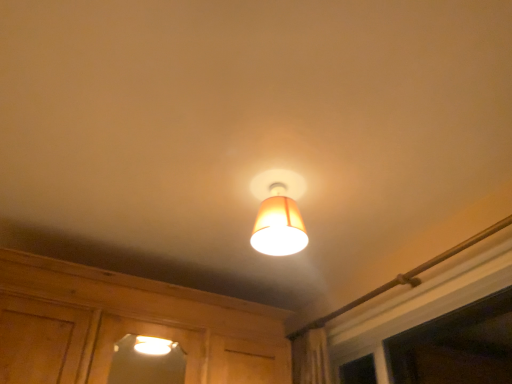
Locate an element on the screen. The width and height of the screenshot is (512, 384). matte orange fabric lampshade at center is located at coordinates (278, 213).

Describe the element at coordinates (278, 213) in the screenshot. This screenshot has height=384, width=512. I see `matte orange fabric lampshade at center` at that location.

The height and width of the screenshot is (384, 512). What do you see at coordinates (457, 346) in the screenshot?
I see `white plastic window at upper right` at bounding box center [457, 346].

Measure the distance between white plastic window at upper right and camera.

The depth of white plastic window at upper right is 7.10 feet.

The width and height of the screenshot is (512, 384). I want to click on white plastic window at upper right, so click(457, 346).

Locate an element on the screen. The width and height of the screenshot is (512, 384). matte orange fabric lampshade at center is located at coordinates (278, 213).

Which object is positioned more to the right, matte orange fabric lampshade at center or white plastic window at upper right?

From the viewer's perspective, white plastic window at upper right appears more on the right side.

Which is behind, matte orange fabric lampshade at center or white plastic window at upper right?

matte orange fabric lampshade at center is behind.

Is point (275, 196) closer or farther from the camera than point (449, 368)?

Clearly, point (275, 196) is closer to the camera than point (449, 368).

From the image's perspective, is matte orange fabric lampshade at center above white plastic window at upper right?

Yes, from the image's perspective, matte orange fabric lampshade at center is over white plastic window at upper right.

From a real-world perspective, is matte orange fabric lampshade at center located beneath white plastic window at upper right?

No, from a real-world perspective, matte orange fabric lampshade at center is not under white plastic window at upper right.

Based on the photo, can you confirm if matte orange fabric lampshade at center is thinner than white plastic window at upper right?

Incorrect, the width of matte orange fabric lampshade at center is not less than that of white plastic window at upper right.

Who is shorter, matte orange fabric lampshade at center or white plastic window at upper right?

With less height is matte orange fabric lampshade at center.

Who is smaller, matte orange fabric lampshade at center or white plastic window at upper right?

matte orange fabric lampshade at center.

Is matte orange fabric lampshade at center located outside white plastic window at upper right?

Yes, matte orange fabric lampshade at center is not within white plastic window at upper right.

Are matte orange fabric lampshade at center and white plastic window at upper right making contact?

No, matte orange fabric lampshade at center is not next to white plastic window at upper right.

Is matte orange fabric lampshade at center looking in the opposite direction of white plastic window at upper right?

No.

What's the angular difference between matte orange fabric lampshade at center and white plastic window at upper right's facing directions?

The angular difference between matte orange fabric lampshade at center and white plastic window at upper right is 90 degrees.

Measure the distance between matte orange fabric lampshade at center and white plastic window at upper right.

matte orange fabric lampshade at center and white plastic window at upper right are 1.38 meters apart from each other.

In order to click on window that appears on the right of matte orange fabric lampshade at center in this screenshot , I will do `click(457, 346)`.

Which object is positioned more to the right, white plastic window at upper right or matte orange fabric lampshade at center?

white plastic window at upper right.

Is white plastic window at upper right closer to the viewer compared to matte orange fabric lampshade at center?

That is True.

Considering the points (448, 344) and (258, 216), which point is behind, point (448, 344) or point (258, 216)?

The point (448, 344) is farther.

From the image's perspective, is white plastic window at upper right on top of matte orange fabric lampshade at center?

No.

From a real-world perspective, which is physically above, white plastic window at upper right or matte orange fabric lampshade at center?

matte orange fabric lampshade at center, from a real-world perspective.

Considering the sizes of objects white plastic window at upper right and matte orange fabric lampshade at center in the image provided, who is wider, white plastic window at upper right or matte orange fabric lampshade at center?

With larger width is matte orange fabric lampshade at center.

Between white plastic window at upper right and matte orange fabric lampshade at center, which one has more height?

Standing taller between the two is white plastic window at upper right.

Does white plastic window at upper right have a smaller size compared to matte orange fabric lampshade at center?

No, white plastic window at upper right is not smaller than matte orange fabric lampshade at center.

Choose the correct answer: Is white plastic window at upper right inside matte orange fabric lampshade at center or outside it?

white plastic window at upper right is not enclosed by matte orange fabric lampshade at center.

Would you consider white plastic window at upper right to be distant from matte orange fabric lampshade at center?

Absolutely, white plastic window at upper right is distant from matte orange fabric lampshade at center.

Is matte orange fabric lampshade at center at the back of white plastic window at upper right?

No, white plastic window at upper right is not facing away from matte orange fabric lampshade at center.

How different are the orientations of white plastic window at upper right and matte orange fabric lampshade at center in degrees?

They differ by 90 degrees in their facing directions.

Consider the image. Measure the distance from white plastic window at upper right to matte orange fabric lampshade at center.

They are 4.54 feet apart.

You are a GUI agent. You are given a task and a screenshot of the screen. Output one action in this format:
    pyautogui.click(x=<x>, y=<y>)
    Task: Click on the window in front of the matte orange fabric lampshade at center
    Image resolution: width=512 pixels, height=384 pixels.
    Given the screenshot: What is the action you would take?
    (x=457, y=346)

You are a GUI agent. You are given a task and a screenshot of the screen. Output one action in this format:
    pyautogui.click(x=<x>, y=<y>)
    Task: Click on the window below the matte orange fabric lampshade at center (from the image's perspective)
    
    Given the screenshot: What is the action you would take?
    pyautogui.click(x=457, y=346)

You are a GUI agent. You are given a task and a screenshot of the screen. Output one action in this format:
    pyautogui.click(x=<x>, y=<y>)
    Task: Click on the window on the right side of matte orange fabric lampshade at center
    
    Given the screenshot: What is the action you would take?
    pyautogui.click(x=457, y=346)